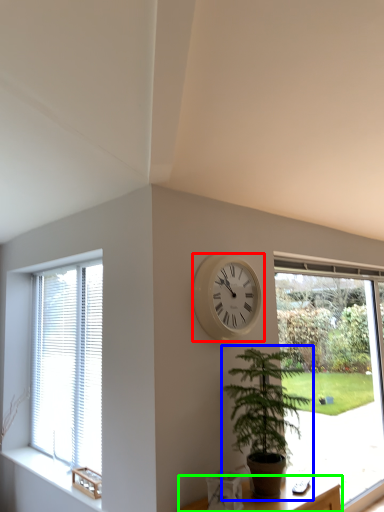
Question: Estimate the real-world distances between objects in this image. Which object is closer to wall clock (highlighted by a red box), houseplant (highlighted by a blue box) or furniture (highlighted by a green box)?

Choices:
 (A) houseplant
 (B) furniture

Answer: (A)